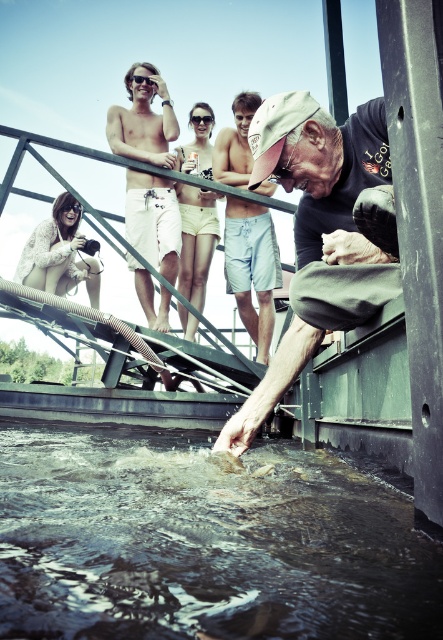
Question: Which point is closer to the camera?

Choices:
 (A) white knitted sweater at lower left
 (B) matte white shorts at upper left
 (C) matte black sunglasses at upper left

Answer: (B)

Question: Which point is closer to the camera taking this photo?

Choices:
 (A) (152, 70)
 (B) (302, 106)
 (C) (143, 81)
 (D) (136, 496)

Answer: (D)

Question: Does clear plastic goggles at center appear over black plastic sunglasses at upper center?

Choices:
 (A) no
 (B) yes

Answer: (A)

Question: Does dark water at lower center come behind black plastic sunglasses at upper center?

Choices:
 (A) yes
 (B) no

Answer: (B)

Question: Can you confirm if dark water at lower center is positioned to the left of light blue shorts at center?

Choices:
 (A) no
 (B) yes

Answer: (B)

Question: Which point is closer to the camera?

Choices:
 (A) matte white shorts at upper left
 (B) light blue shorts at center
 (C) black plastic sunglasses at upper center

Answer: (B)